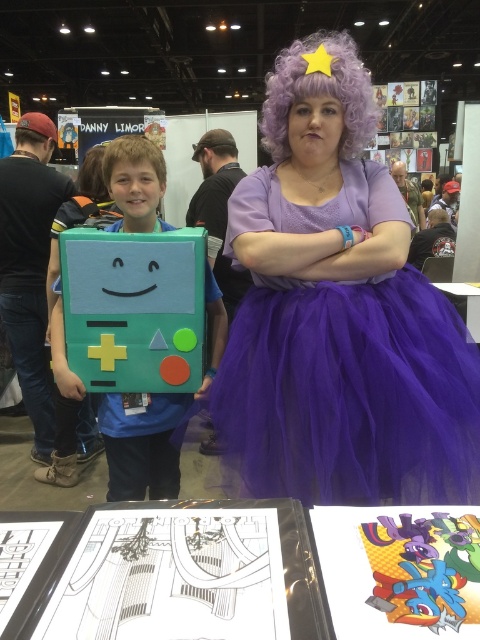
You are a photographer at the event and want to take a photo of the purple tulle dress at center and the multicolored paper art at center. Which object should you focus on first if you want to capture both in a single shot without moving the camera?

The purple tulle dress at center is taller than the multicolored paper art at center, so you should focus on the purple tulle dress at center first to ensure it is fully captured in the frame.

You are a photographer at the event and need to ensure both the purple tulle dress at center and the multicolored paper art at center fit within a 1.5 meter wide frame. Given their widths, will both items fit side by side?

The purple tulle dress at center is wider than the multicolored paper art at center. Since the total width of both items combined would exceed 1.5 meters, they cannot fit side by side within the frame.